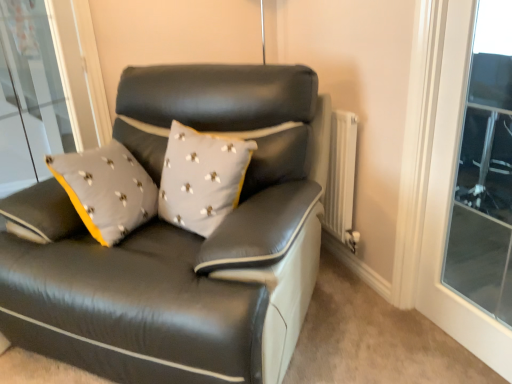
I want to click on matte black leather couch at center, so click(181, 240).

This screenshot has width=512, height=384. Describe the element at coordinates (341, 179) in the screenshot. I see `white textured radiator at right` at that location.

Locate an element on the screen. transparent glass window at upper right is located at coordinates (485, 171).

From the image's perspective, which one is positioned higher, transparent glass window at upper right or matte black leather couch at center?

transparent glass window at upper right is shown above in the image.

Is transparent glass window at upper right far away from matte black leather couch at center?

Yes, transparent glass window at upper right and matte black leather couch at center are located far from each other.

Considering the sizes of objects transparent glass window at upper right and matte black leather couch at center in the image provided, who is shorter, transparent glass window at upper right or matte black leather couch at center?

matte black leather couch at center.

Considering the relative sizes of transparent glass window at upper right and matte black leather couch at center in the image provided, is transparent glass window at upper right smaller than matte black leather couch at center?

Yes.

Which of these two, transparent glass window at upper right or white textured radiator at right, is bigger?

white textured radiator at right.

Is transparent glass window at upper right looking in the opposite direction of white textured radiator at right?

No, transparent glass window at upper right is not facing away from white textured radiator at right.

How different are the orientations of transparent glass window at upper right and white textured radiator at right in degrees?

The facing directions of transparent glass window at upper right and white textured radiator at right are 0.272 degrees apart.

From the image's perspective, is matte black leather couch at center above or below white textured radiator at right?

matte black leather couch at center is below white textured radiator at right.

Between matte black leather couch at center and white textured radiator at right, which one is positioned behind?

white textured radiator at right is more distant.

From a real-world perspective, is matte black leather couch at center positioned over white textured radiator at right based on gravity?

Yes, from a real-world perspective, matte black leather couch at center is on top of white textured radiator at right.

Could you tell me if white textured radiator at right is turned towards matte black leather couch at center?

Yes, white textured radiator at right is turned towards matte black leather couch at center.

Can you confirm if white textured radiator at right is bigger than matte black leather couch at center?

Actually, white textured radiator at right might be smaller than matte black leather couch at center.

In the scene shown: From the image's perspective, is white textured radiator at right positioned above or below matte black leather couch at center?

white textured radiator at right is above matte black leather couch at center.

This screenshot has height=384, width=512. In order to click on studio couch that appears in front of the white textured radiator at right in this screenshot , I will do `click(181, 240)`.

Does matte black leather couch at center appear on the left side of transparent glass window at upper right?

Indeed, matte black leather couch at center is positioned on the left side of transparent glass window at upper right.

From the image's perspective, is matte black leather couch at center located above or below transparent glass window at upper right?

From the image's perspective, matte black leather couch at center appears below transparent glass window at upper right.

Find the location of a particular element. studio couch in front of the transparent glass window at upper right is located at coordinates (181, 240).

Based on the photo, is matte black leather couch at center taller or shorter than transparent glass window at upper right?

In the image, matte black leather couch at center appears to be shorter than transparent glass window at upper right.

Considering the positions of point (342, 152) and point (499, 219), is point (342, 152) closer or farther from the camera than point (499, 219)?

Point (342, 152) is closer to the camera than point (499, 219).

Is white textured radiator at right bigger than transparent glass window at upper right?

Correct, white textured radiator at right is larger in size than transparent glass window at upper right.

From the image's perspective, is white textured radiator at right positioned above or below transparent glass window at upper right?

white textured radiator at right is situated higher than transparent glass window at upper right in the image.

From a real-world perspective, is white textured radiator at right on top of transparent glass window at upper right?

No.

Find the location of a particular element. The height and width of the screenshot is (384, 512). window lying on the right of matte black leather couch at center is located at coordinates (485, 171).

You are a GUI agent. You are given a task and a screenshot of the screen. Output one action in this format:
    pyautogui.click(x=<x>, y=<y>)
    Task: Click on the radiator that is behind the transparent glass window at upper right
    The height and width of the screenshot is (384, 512).
    Given the screenshot: What is the action you would take?
    pyautogui.click(x=341, y=179)

From the image, which object appears to be farther from matte black leather couch at center, white textured radiator at right or transparent glass window at upper right?

transparent glass window at upper right is positioned further to the anchor matte black leather couch at center.

Estimate the real-world distances between objects in this image. Which object is further from transparent glass window at upper right, matte black leather couch at center or white textured radiator at right?

Based on the image, matte black leather couch at center appears to be further to transparent glass window at upper right.

Based on their spatial positions, is matte black leather couch at center or transparent glass window at upper right closer to white textured radiator at right?

Among the two, matte black leather couch at center is located nearer to white textured radiator at right.

Looking at this image, estimate the real-world distances between objects in this image. Which object is further from transparent glass window at upper right, white textured radiator at right or matte black leather couch at center?

The object further to transparent glass window at upper right is matte black leather couch at center.

Considering their positions, is transparent glass window at upper right positioned further to white textured radiator at right than matte black leather couch at center?

transparent glass window at upper right is further to white textured radiator at right.

Looking at the image, which one is located closer to matte black leather couch at center, transparent glass window at upper right or white textured radiator at right?

Among the two, white textured radiator at right is located nearer to matte black leather couch at center.

This screenshot has height=384, width=512. I want to click on radiator between matte black leather couch at center and transparent glass window at upper right in the horizontal direction, so click(341, 179).